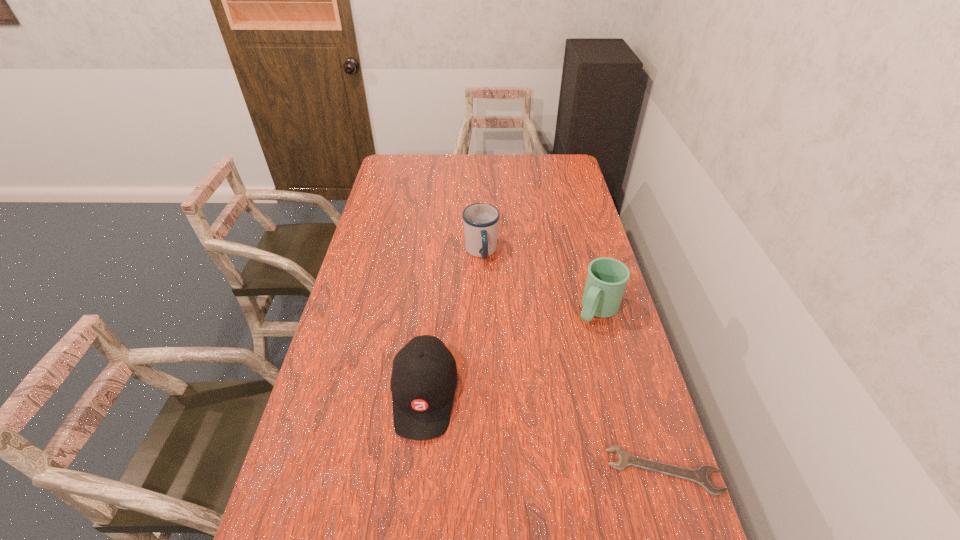
Locate an element on the screen. vacant area that lies between the shortest object and the nearer mug is located at coordinates (631, 390).

Where is `free spot between the nearer mug and the farther mug`? free spot between the nearer mug and the farther mug is located at coordinates (540, 281).

Find the location of a particular element. The image size is (960, 540). object that ranks as the second closest to the right mug is located at coordinates (701, 476).

You are a GUI agent. You are given a task and a screenshot of the screen. Output one action in this format:
    pyautogui.click(x=<x>, y=<y>)
    Task: Click on the object identified as the closest to the farthest object
    This screenshot has height=540, width=960.
    Given the screenshot: What is the action you would take?
    pyautogui.click(x=606, y=280)

Image resolution: width=960 pixels, height=540 pixels. What are the coordinates of `vacant region that satisfies the following two spatial constraints: 1. with a logo on the front of the shortest object; 2. on the left side of the second nearest object` in the screenshot? It's located at (417, 470).

Where is `vacant position in the image that satisfies the following two spatial constraints: 1. with a logo on the front of the wrench; 2. on the right side of the second nearest object`? vacant position in the image that satisfies the following two spatial constraints: 1. with a logo on the front of the wrench; 2. on the right side of the second nearest object is located at coordinates (417, 470).

Locate an element on the screen. The image size is (960, 540). vacant region that satisfies the following two spatial constraints: 1. with a logo on the front of the baseball cap; 2. on the right side of the wrench is located at coordinates (417, 470).